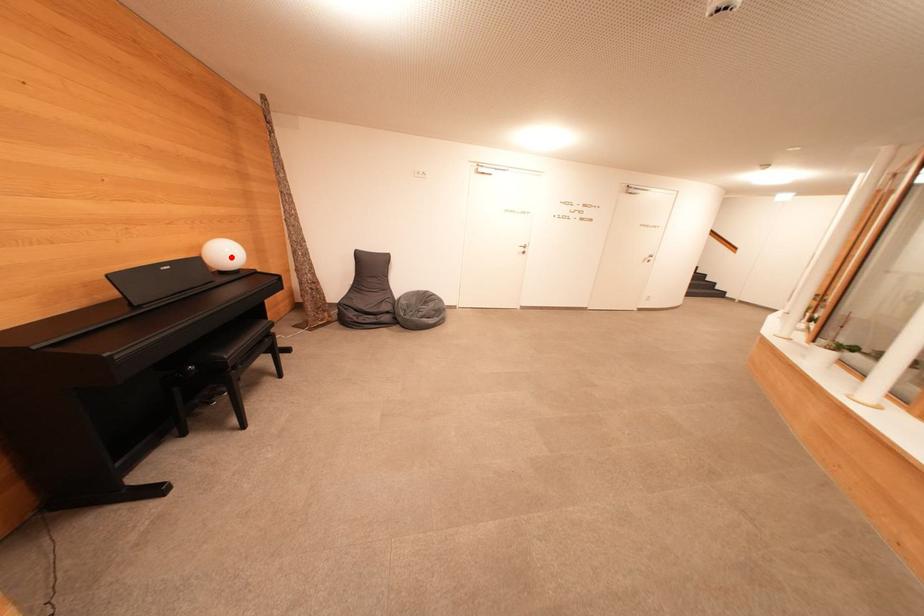
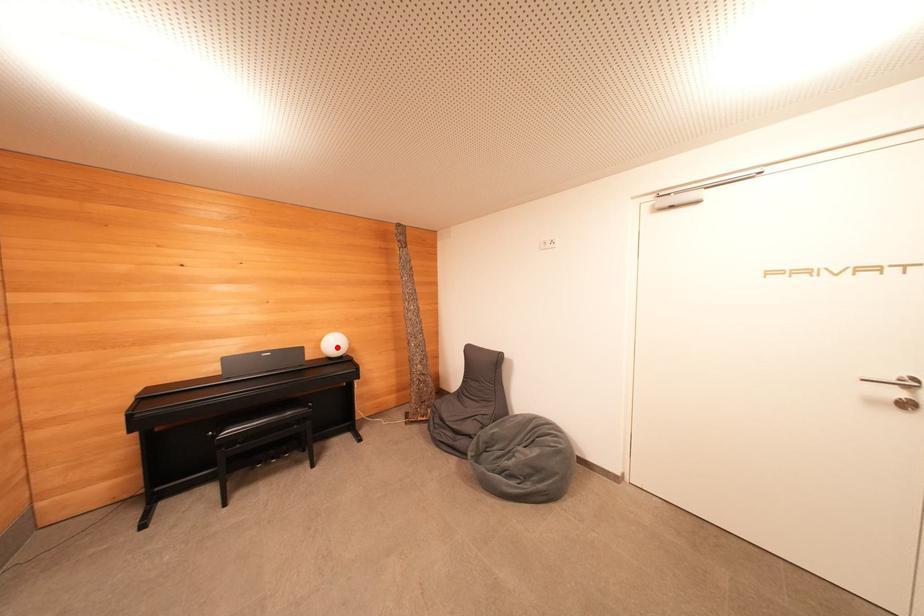
I am providing you with two images of the same scene from different viewpoints. A red point is marked on the first image and another point is marked on the second image. Does the point marked in image1 correspond to the same location as the one in image2?

Yes